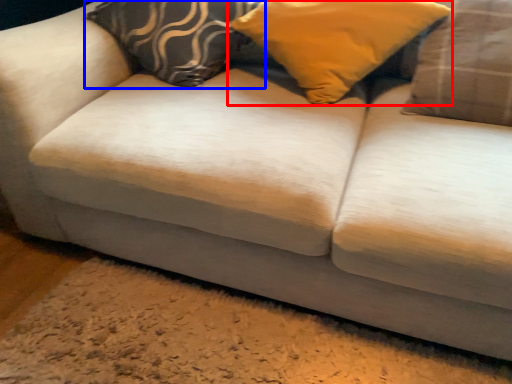
Question: Among these objects, which one is farthest to the camera, pillow (highlighted by a red box) or pillow (highlighted by a blue box)?

Choices:
 (A) pillow
 (B) pillow

Answer: (B)